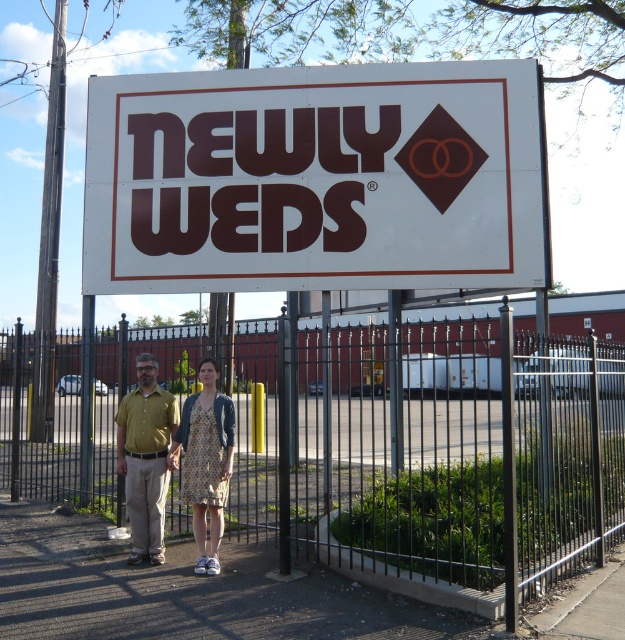
From the picture: Does white plastic sign at center have a larger size compared to printed fabric dress at center?

Correct, white plastic sign at center is larger in size than printed fabric dress at center.

Does point (146, 180) come in front of point (212, 444)?

No, it is behind (212, 444).

Is point (325, 70) more distant than point (201, 440)?

Yes, it is.

Where is `white plastic sign at center`? white plastic sign at center is located at coordinates (316, 179).

Can you confirm if black metal fence at center is positioned to the right of printed fabric dress at center?

Correct, you'll find black metal fence at center to the right of printed fabric dress at center.

Between black metal fence at center and printed fabric dress at center, which one has less height?

With less height is printed fabric dress at center.

At what (x,y) coordinates should I click in order to perform the action: click on black metal fence at center. Please return your answer as a coordinate pair (x, y). The width and height of the screenshot is (625, 640). Looking at the image, I should click on (428, 451).

Does yellow-green shirt at center have a greater width compared to printed fabric dress at center?

Indeed, yellow-green shirt at center has a greater width compared to printed fabric dress at center.

The height and width of the screenshot is (640, 625). In order to click on yellow-green shirt at center in this screenshot , I will do `click(146, 458)`.

Is point (141, 497) less distant than point (216, 428)?

No.

At what (x,y) coordinates should I click in order to perform the action: click on yellow-green shirt at center. Please return your answer as a coordinate pair (x, y). Looking at the image, I should click on (146, 458).